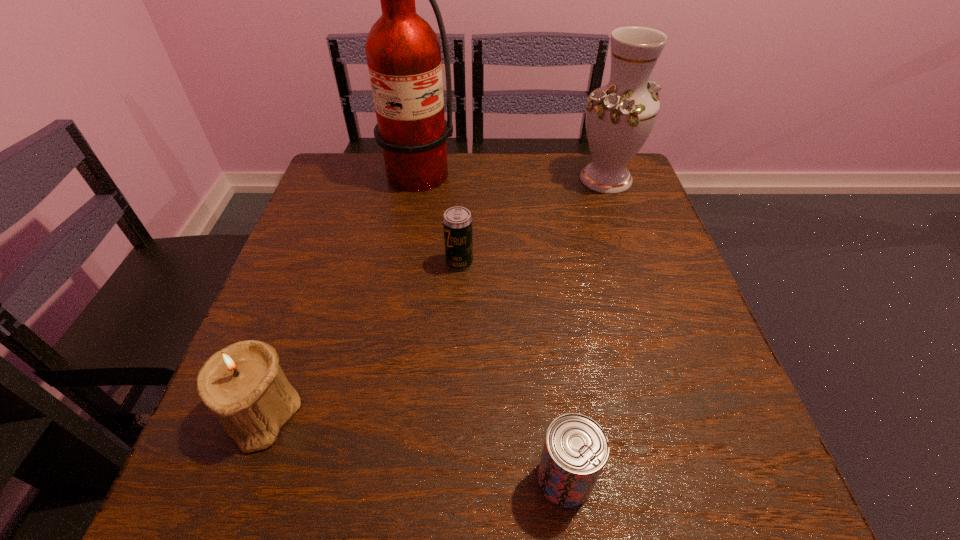
The image size is (960, 540). What are the coordinates of `object that is at the far left corner` in the screenshot? It's located at coord(403,53).

Find the location of `object located at the near left corner`. object located at the near left corner is located at coordinates (x=242, y=383).

Where is `object positioned at the far right corner`? The height and width of the screenshot is (540, 960). object positioned at the far right corner is located at coordinates (620, 116).

The width and height of the screenshot is (960, 540). In the image, there is a desktop. Find the location of `free space at the far edge`. free space at the far edge is located at coordinates (548, 166).

The width and height of the screenshot is (960, 540). In the image, there is a desktop. In order to click on vacant region at the left edge in this screenshot , I will do `click(305, 228)`.

Locate an element on the screen. The image size is (960, 540). vacant area at the right edge is located at coordinates (612, 294).

Find the location of a particular element. The image size is (960, 540). free location at the near right corner of the desktop is located at coordinates (659, 477).

I want to click on empty space between the fire extinguisher and the fourth object from left to right, so click(484, 327).

What are the coordinates of `vacant area that lies between the farther beer can and the third shortest object` in the screenshot? It's located at (360, 338).

Where is `free space between the fourth object from left to right and the vase`? The height and width of the screenshot is (540, 960). free space between the fourth object from left to right and the vase is located at coordinates (586, 329).